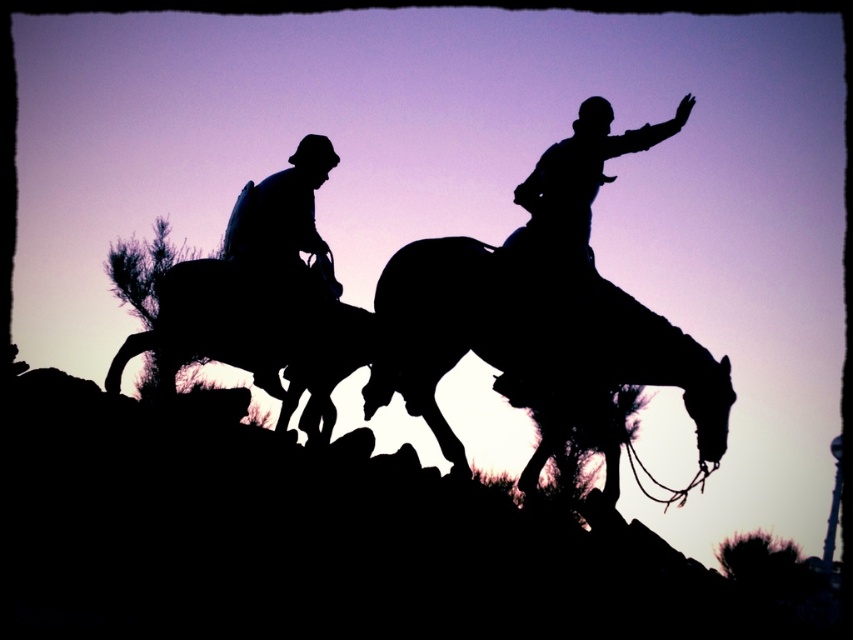
Based on the provided scene, where is the silhouette horse at center located in terms of coordinates?

The silhouette horse at center is located at coordinates point (531, 348).

You are a photographer trying to capture the two silhouette horses in the scene. The silhouette horse at center and the silhouette horse at left are both in your viewfinder. Based on their sizes in the image, which horse would appear closer to you?

The silhouette horse at left appears closer because it is larger than the silhouette horse at center.

You are a photographer trying to capture the two silhouette horses in the scene. The camera you are using has a maximum focus range of 2 meters. Can you fit both the silhouette horse at center and the silhouette horse at left into the same frame without moving the camera?

The silhouette horse at center is 2.25 meters away from the silhouette horse at left. Since the distance between them exceeds the camera maximum focus range of 2 meters, you cannot fit both into the same frame without moving the camera.